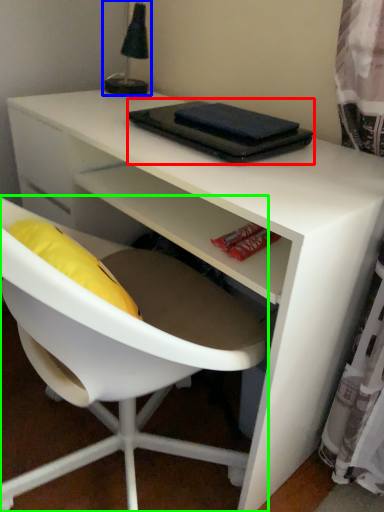
Question: Based on their relative distances, which object is farther from notebook (highlighted by a red box)? Choose from table lamp (highlighted by a blue box) and chair (highlighted by a green box).

Choices:
 (A) table lamp
 (B) chair

Answer: (A)